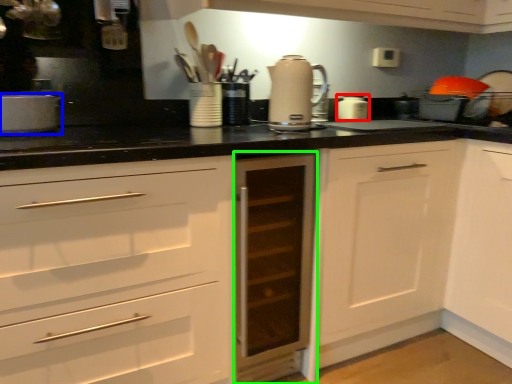
Question: Based on their relative distances, which object is nearer to kitchen appliance (highlighted by a red box)? Choose from kitchen appliance (highlighted by a blue box) and cabinetry (highlighted by a green box).

Choices:
 (A) kitchen appliance
 (B) cabinetry

Answer: (B)